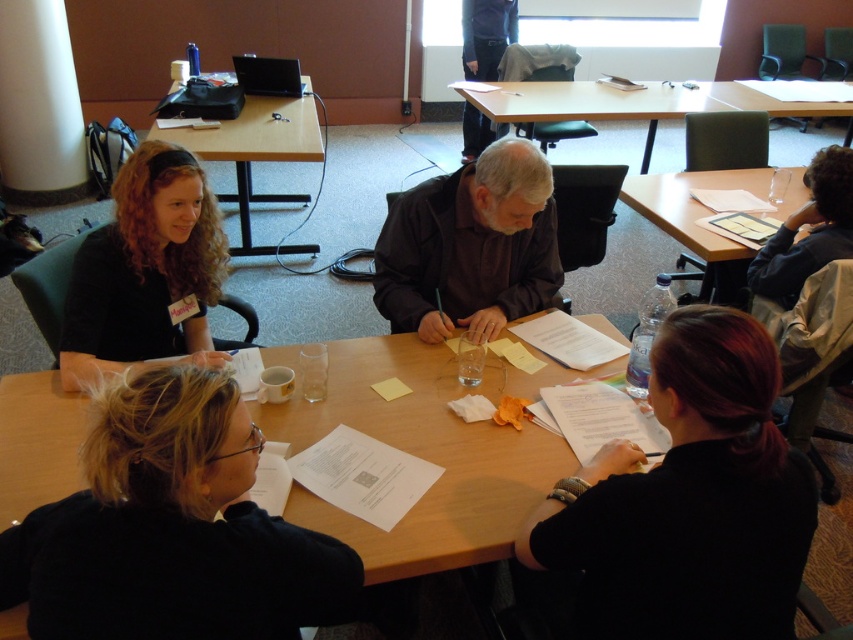
In the conference room scene, you notice the blonde hair at center and the clear plastic water bottle at right. Which object is located above the other?

The clear plastic water bottle at right is above the blonde hair at center because the blonde hair at center is positioned under the clear plastic water bottle at right.

Based on the scene description, can you determine if the curly hair at center is narrower than the wooden table at center?

Yes, the curly hair at center is narrower than the wooden table at center because the curly hair at center has a width less than the wooden table at center.